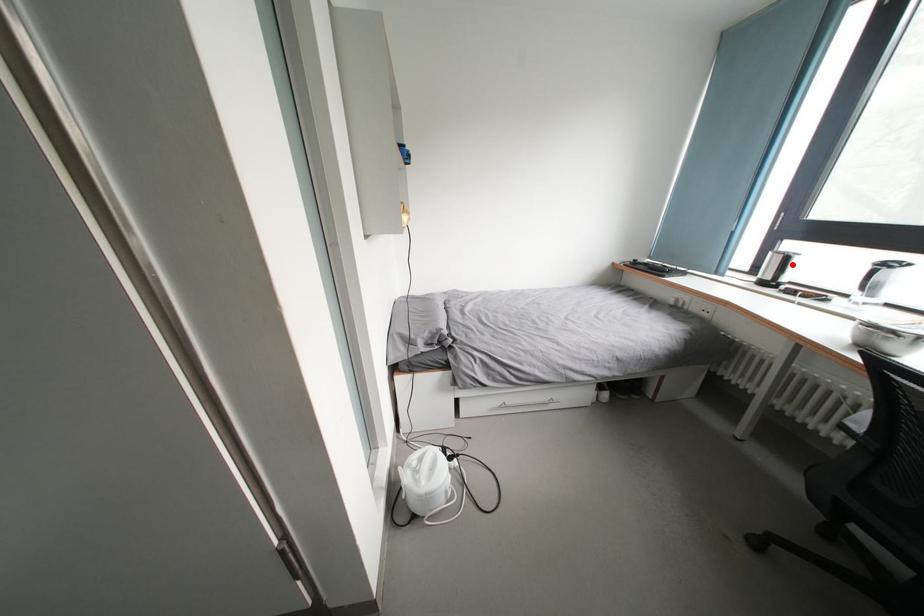
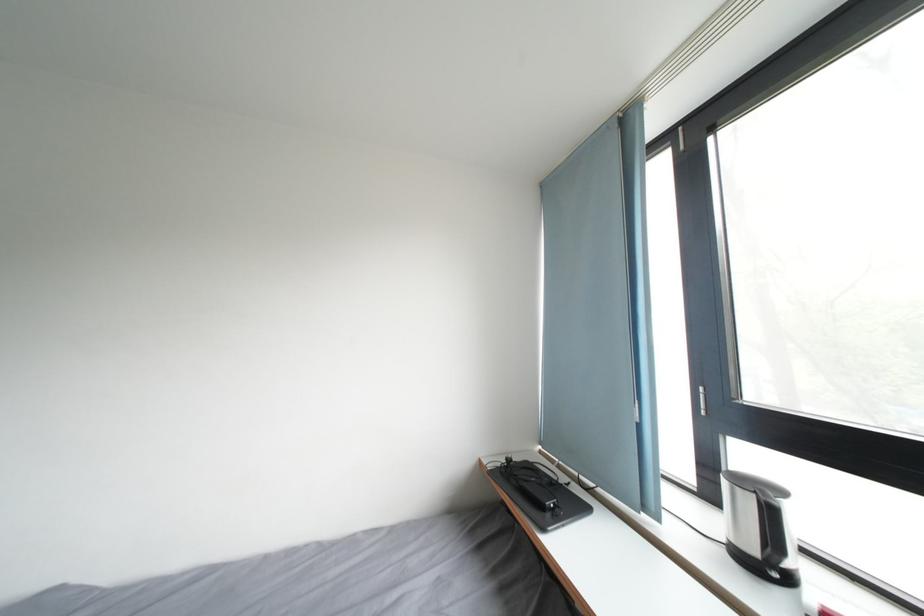
Where in the second image is the point corresponding to the highlighted location from the first image?

(776, 517)